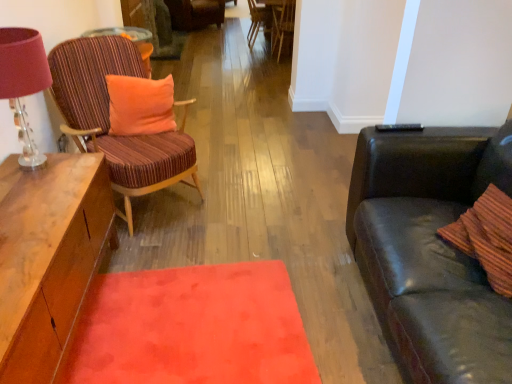
Question: Is striped fabric chair at left, the 4th chair when ordered from top to bottom, oriented towards matte wood desk at upper left?

Choices:
 (A) yes
 (B) no

Answer: (B)

Question: From a real-world perspective, is striped fabric chair at left, the 4th chair when ordered from back to front, over matte wood desk at upper left?

Choices:
 (A) no
 (B) yes

Answer: (A)

Question: Can you confirm if striped fabric chair at left, the 4th chair when ordered from back to front, is thinner than matte wood desk at upper left?

Choices:
 (A) no
 (B) yes

Answer: (A)

Question: From the image's perspective, is striped fabric chair at left, the 1th chair in the bottom-to-top sequence, located above matte wood desk at upper left?

Choices:
 (A) no
 (B) yes

Answer: (A)

Question: Is striped fabric chair at left, which is the first chair in front-to-back order, far from matte wood desk at upper left?

Choices:
 (A) yes
 (B) no

Answer: (B)

Question: Based on their positions, is wooden chair at center, the second chair viewed from the top, located to the left or right of orange plush pillow at left?

Choices:
 (A) left
 (B) right

Answer: (B)

Question: Looking at the image, does wooden chair at center, which is the third chair from front to back, seem bigger or smaller compared to orange plush pillow at left?

Choices:
 (A) big
 (B) small

Answer: (A)

Question: From a real-world perspective, is wooden chair at center, which is the third chair from front to back, positioned above or below orange plush pillow at left?

Choices:
 (A) below
 (B) above

Answer: (A)

Question: From the image's perspective, relative to orange plush pillow at left, is wooden chair at center, which is the third chair from front to back, above or below?

Choices:
 (A) below
 (B) above

Answer: (B)

Question: In terms of width, does wooden chair at center, which ranks as the third chair in top-to-bottom order, look wider or thinner when compared to orange plush pillow at left?

Choices:
 (A) wide
 (B) thin

Answer: (A)

Question: Is point (279, 0) positioned closer to the camera than point (144, 130)?

Choices:
 (A) closer
 (B) farther

Answer: (B)

Question: From the image's perspective, relative to orange plush pillow at left, is wooden chair at center, which ranks as the third chair in top-to-bottom order, above or below?

Choices:
 (A) above
 (B) below

Answer: (A)

Question: From a real-world perspective, is wooden chair at center, the 2th chair from the bottom, positioned above or below orange plush pillow at left?

Choices:
 (A) below
 (B) above

Answer: (A)

Question: Considering their positions, is wooden chair at center, the second chair viewed from the top, located in front of or behind matte pink lampshade at left?

Choices:
 (A) behind
 (B) front

Answer: (A)

Question: From their relative heights in the image, would you say wooden chair at center, positioned as the 2th chair in back-to-front order, is taller or shorter than matte pink lampshade at left?

Choices:
 (A) short
 (B) tall

Answer: (B)